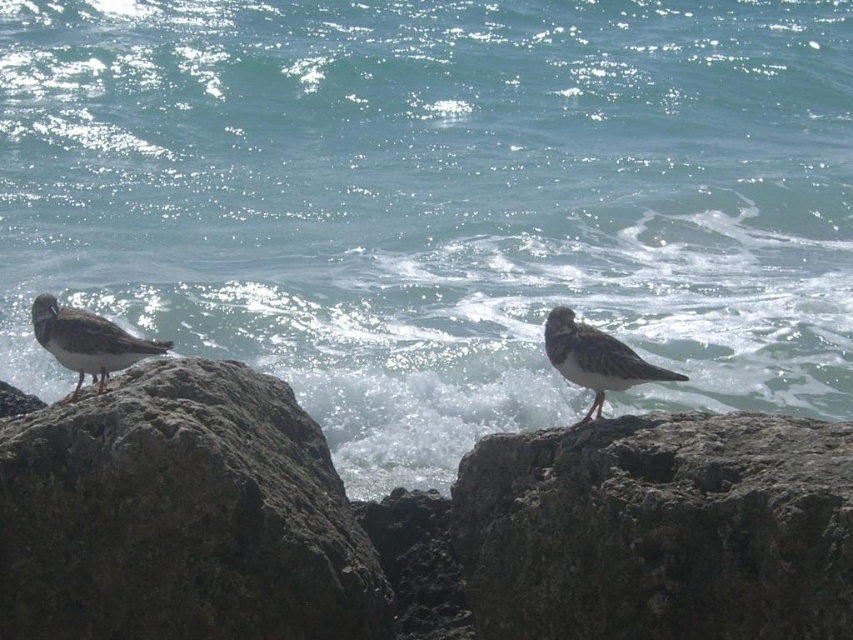
You are a photographer trying to capture the gray matte bird at center without including the gray rough rock at center in the frame. Given their relative sizes, is it possible to do so by adjusting your camera angle?

The gray rough rock at center is wider than the gray matte bird at center. Since the rock is wider, you can adjust your camera angle to frame the bird while excluding the wider rock by focusing on the narrower bird.

You are a wildlife photographer trying to capture a photo of both the speckled gray bird at left and the gray matte bird at center. Since you want to ensure both birds are clearly visible in the frame, which bird should you focus on first to account for their size difference?

The speckled gray bird at left is larger than the gray matte bird at center, so you should focus on the speckled gray bird at left first to ensure its details are sharp before adjusting for the smaller bird.